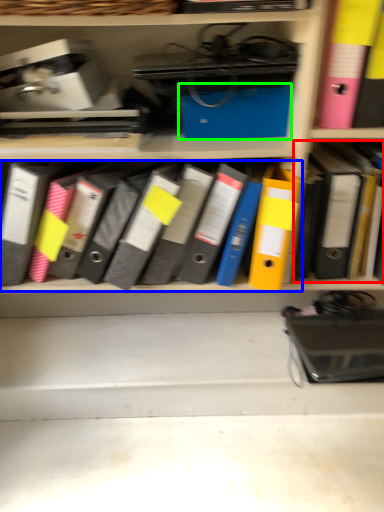
Question: Estimate the real-world distances between objects in this image. Which object is closer to book (highlighted by a red box), notebook (highlighted by a blue box) or paperback book (highlighted by a green box)?

Choices:
 (A) notebook
 (B) paperback book

Answer: (B)